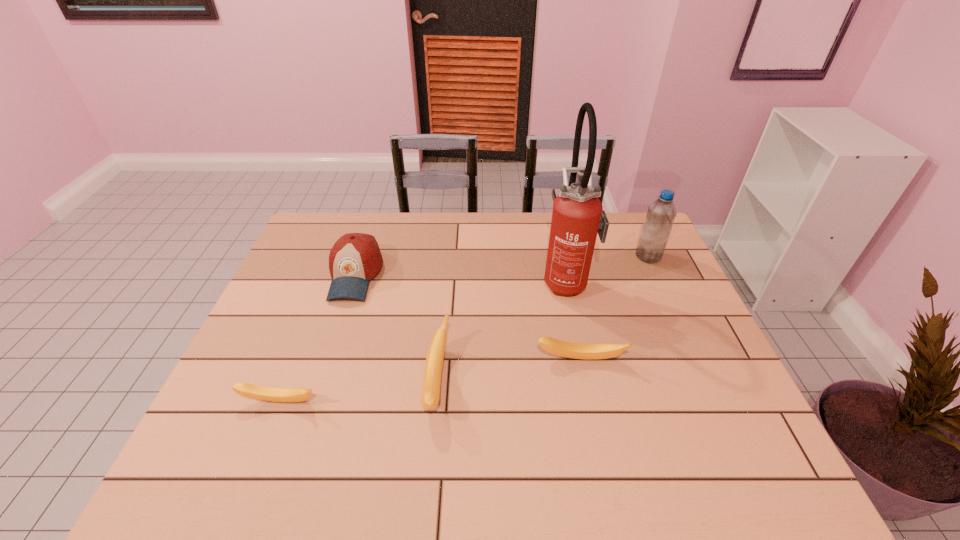
Considering the uniform spacing of bananas, where should an additional banana be positioned on the right? Please locate a free spot. Please provide its 2D coordinates. Your answer should be formatted as a tuple, i.e. [(x, y)], where the tuple contains the x and y coordinates of a point satisfying the conditions above.

[(711, 340)]